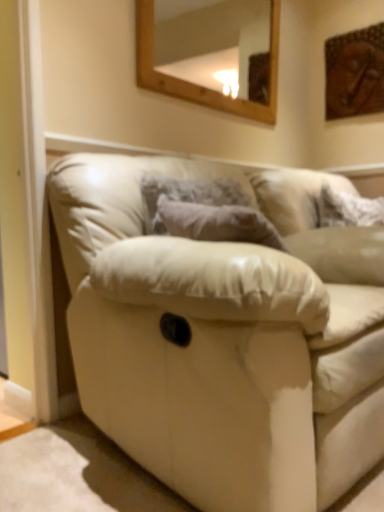
Question: Is wooden-framed mirror at upper center smaller than leather couch at center?

Choices:
 (A) yes
 (B) no

Answer: (A)

Question: Is wooden-framed mirror at upper center bigger than leather couch at center?

Choices:
 (A) no
 (B) yes

Answer: (A)

Question: From a real-world perspective, is wooden-framed mirror at upper center positioned under leather couch at center based on gravity?

Choices:
 (A) yes
 (B) no

Answer: (B)

Question: Does wooden-framed mirror at upper center have a lesser width compared to leather couch at center?

Choices:
 (A) no
 (B) yes

Answer: (B)

Question: From a real-world perspective, does wooden-framed mirror at upper center stand above leather couch at center?

Choices:
 (A) no
 (B) yes

Answer: (B)

Question: Can you confirm if wooden-framed mirror at upper center is taller than leather couch at center?

Choices:
 (A) no
 (B) yes

Answer: (A)

Question: Is leather couch at center turned away from wooden-framed mirror at upper center?

Choices:
 (A) no
 (B) yes

Answer: (A)

Question: Is leather couch at center positioned far away from wooden-framed mirror at upper center?

Choices:
 (A) no
 (B) yes

Answer: (B)

Question: From the image's perspective, is leather couch at center beneath wooden-framed mirror at upper center?

Choices:
 (A) yes
 (B) no

Answer: (A)

Question: Is leather couch at center aimed at wooden-framed mirror at upper center?

Choices:
 (A) no
 (B) yes

Answer: (A)

Question: Is leather couch at center to the left of wooden-framed mirror at upper center from the viewer's perspective?

Choices:
 (A) yes
 (B) no

Answer: (B)

Question: Can you confirm if leather couch at center is taller than wooden-framed mirror at upper center?

Choices:
 (A) no
 (B) yes

Answer: (B)

Question: Is white fluffy pillow at upper right at the right side of leather couch at center?

Choices:
 (A) no
 (B) yes

Answer: (B)